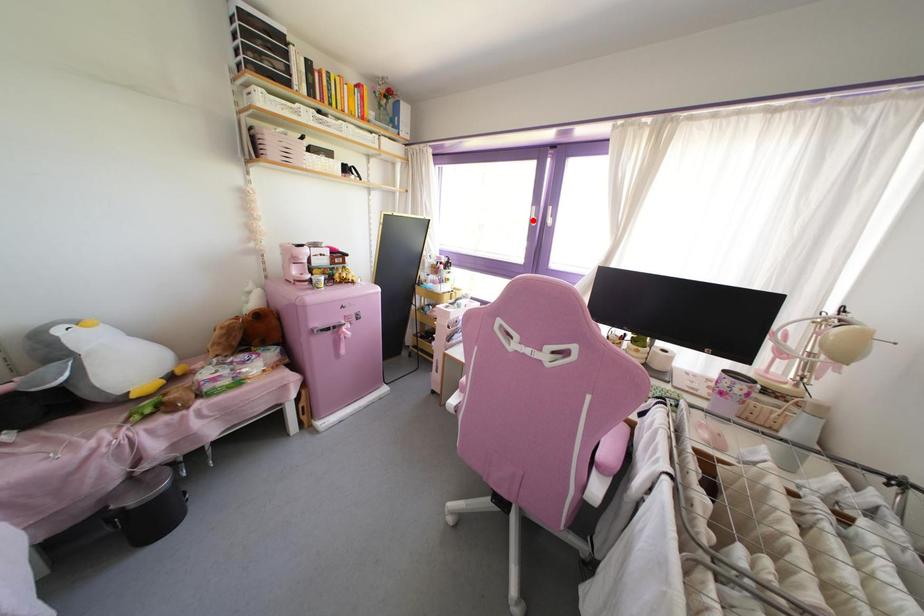
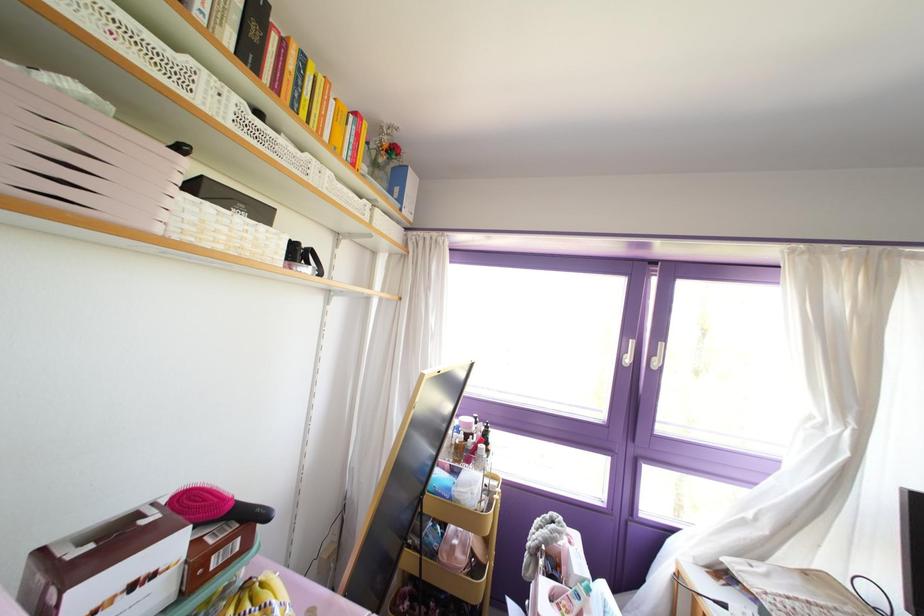
Find the pixel in the second image that matches the highlighted location in the first image.

(626, 360)